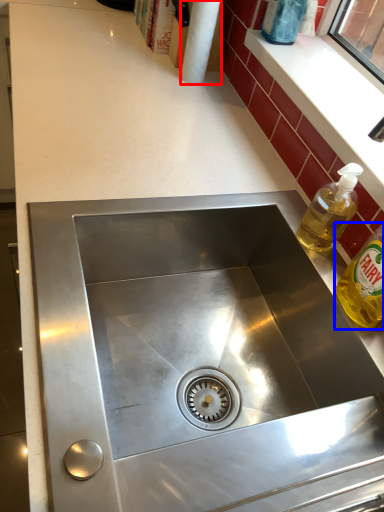
Question: Which of the following is the closest to the observer, paper towel (highlighted by a red box) or bottle (highlighted by a blue box)?

Choices:
 (A) paper towel
 (B) bottle

Answer: (B)